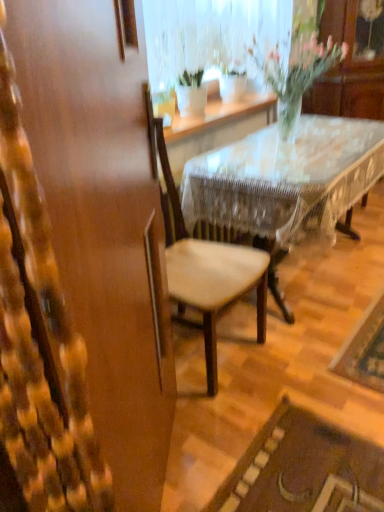
Question: From their relative heights in the image, would you say wooden lace-covered table at center is taller or shorter than translucent glass vase at upper center?

Choices:
 (A) tall
 (B) short

Answer: (A)

Question: Considering the positions of point (276, 137) and point (311, 7), is point (276, 137) closer or farther from the camera than point (311, 7)?

Choices:
 (A) farther
 (B) closer

Answer: (B)

Question: Estimate the real-world distances between objects in this image. Which object is closer to the translucent glass vase at upper center?

Choices:
 (A) wooden chair at center
 (B) wooden lace-covered table at center

Answer: (B)

Question: Which object is positioned farthest from the translucent glass vase at upper center?

Choices:
 (A) wooden chair at center
 (B) wooden lace-covered table at center

Answer: (A)